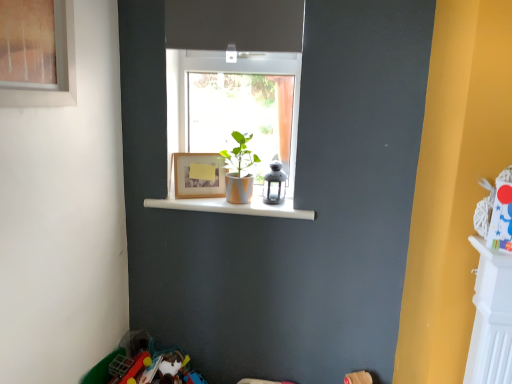
Locate an element on the screen. free space to the left of matte orange pot at center is located at coordinates (207, 201).